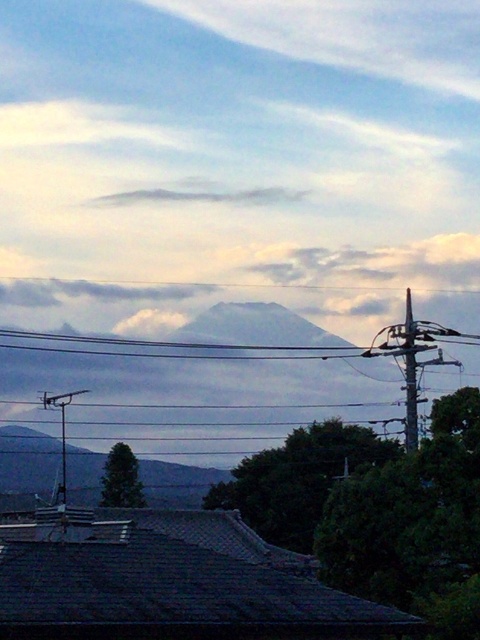
You are an artist sketching the mountain landscape and notice two clouds in the sky. Which cloud, the white cotton cloud at upper center or the white fluffy cloud at upper center, is located to the right?

The white cotton cloud at upper center is positioned on the right side of the white fluffy cloud at upper center, so the white cotton cloud at upper center is located to the right.

Based on the scene, which object is wider when comparing the gray rocky mountain at center and the white fluffy cloud at upper center?

The gray rocky mountain at center is wider than the white fluffy cloud at upper center.

You are a hiker planning to take a photo of the gray rocky mountain at center. You notice a point marked at coordinates (27, 460). Where should you position yourself to capture the mountain in your shot?

The point at coordinates (27, 460) marks the location of the gray rocky mountain at center. To capture the mountain in your photo, position yourself so that the camera is aimed directly at this coordinate point, ensuring the mountain is centered in your frame.